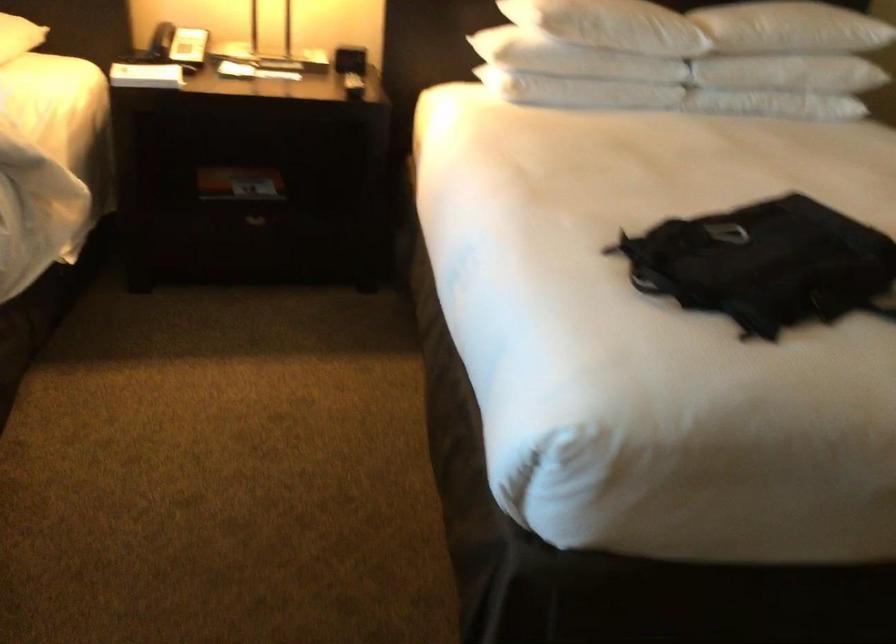
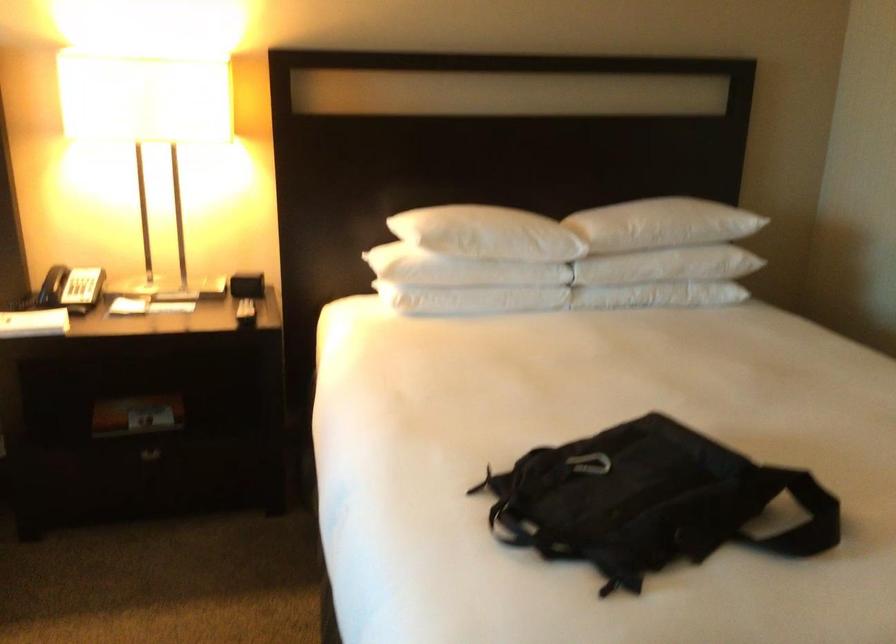
Where in the second image is the point corresponding to [259,221] from the first image?

(151, 456)